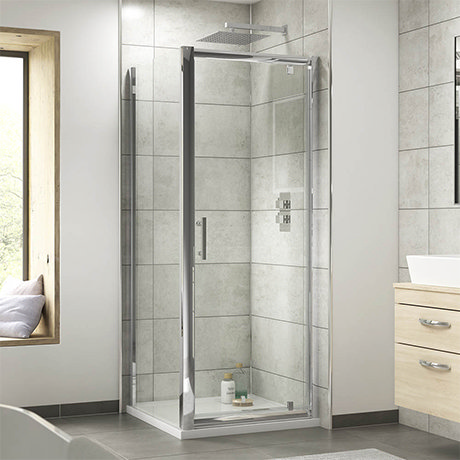
Where is `tiles`? This screenshot has width=460, height=460. tiles is located at coordinates (277, 283).